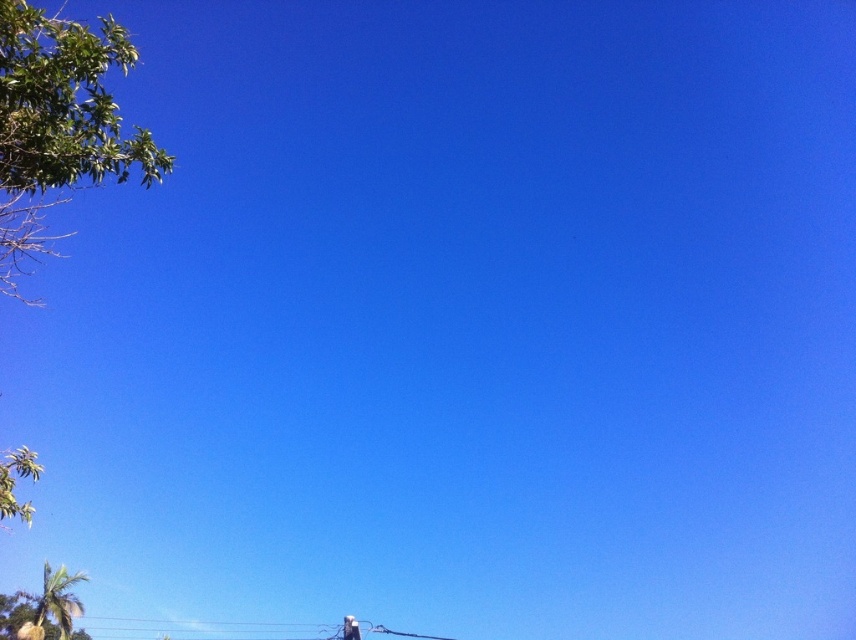
Question: Which object is closer to the camera taking this photo?

Choices:
 (A) green leafy tree at upper left
 (B) green leafy palm tree at upper left

Answer: (A)

Question: Can you confirm if green leafy tree at upper left is positioned below green leafy palm tree at upper left?

Choices:
 (A) no
 (B) yes

Answer: (A)

Question: Can you confirm if green leafy tree at upper left is positioned to the right of green leafy palm tree at upper left?

Choices:
 (A) yes
 (B) no

Answer: (A)

Question: Among these points, which one is nearest to the camera?

Choices:
 (A) coord(58,620)
 (B) coord(4,93)

Answer: (B)

Question: Is green leafy tree at upper left below green leafy palm tree at upper left?

Choices:
 (A) no
 (B) yes

Answer: (A)